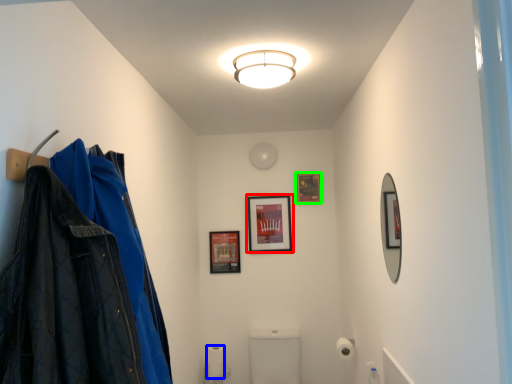
Question: Which is farther away from picture frame (highlighted by a red box)? toilet paper (highlighted by a blue box) or picture frame (highlighted by a green box)?

Choices:
 (A) toilet paper
 (B) picture frame

Answer: (A)